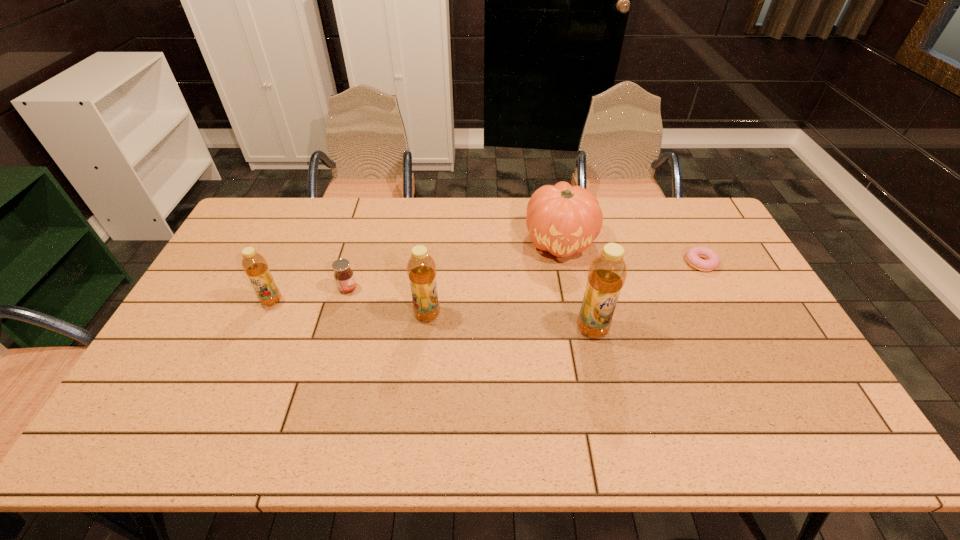
Find the location of `free space in the image that satisfies the following two spatial constraints: 1. on the carved face of the pumpkin; 2. on the label side of the jam`. free space in the image that satisfies the following two spatial constraints: 1. on the carved face of the pumpkin; 2. on the label side of the jam is located at coordinates (569, 288).